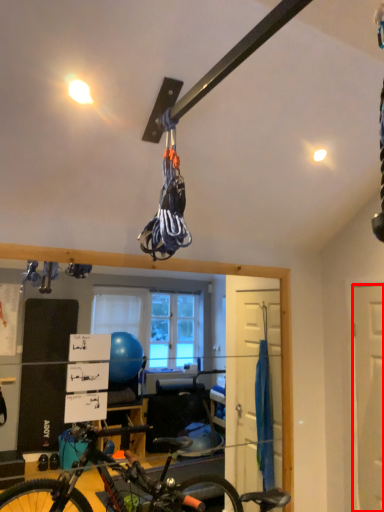
Question: From the image's perspective, what is the correct spatial positioning of door (annotated by the red box) in reference to bicycle?

Choices:
 (A) above
 (B) below

Answer: (A)